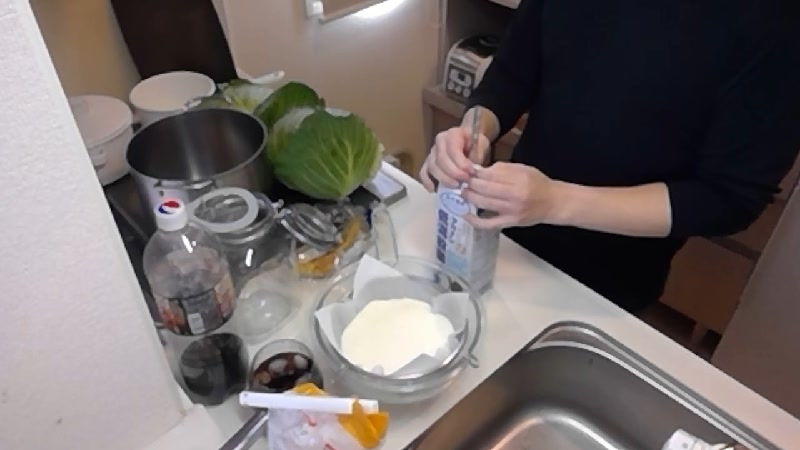
In order to click on counter in this screenshot , I will do tap(524, 321).